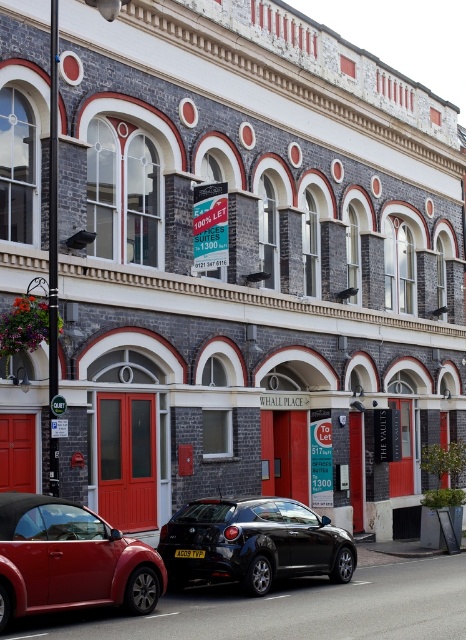
Based on the photo, you are a visitor arriving at the building and see the shiny red convertible at lower left and the shiny black hatchback at center. Which vehicle is parked higher up relative to the other?

The shiny red convertible at lower left is above the shiny black hatchback at center, so it is parked higher up.

Consider the image. You are a delivery person trying to park your van between the shiny red convertible at lower left and the shiny black hatchback at center. Can you fit your van there if it requires 3 meters of space?

The shiny red convertible at lower left occupies less space than shiny black hatchback at center, but the total space between them is not provided. Therefore, it is uncertain if the van can fit.